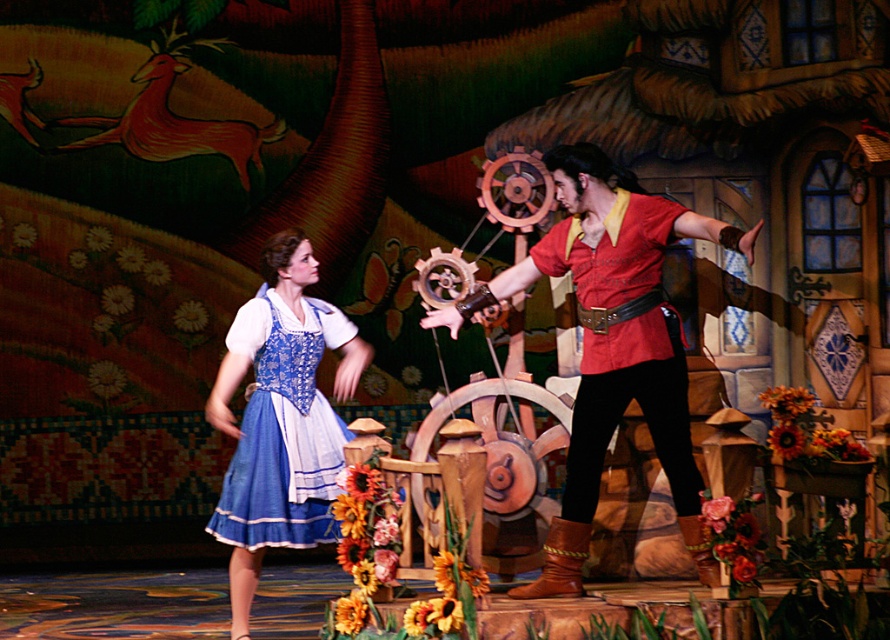
You are an actor positioned at the center of the stage. You need to move to the point that is closer to the front of the stage. Which point should you go to, point (735,234) or point (284,529)?

You should move to point (735,234) because it is in front of point (284,529), making it closer to the front of the stage.

You are an actor positioned at the center of the stage. You need to move to the left to avoid a falling prop. The point you are currently standing on is marked as point (612, 342). Which object is located at this point?

The point (612, 342) is on the matte brown leather glove at center, so you are currently standing on the matte brown leather glove at center.

You are an actor on stage and need to grab an item from the matte brown leather glove at center before the matte red shirt at center. Based on the stage setup described, which item should you approach first from your perspective?

The matte brown leather glove at center is to the left of the matte red shirt at center, so you should approach the matte brown leather glove at center first since it is on your left side.